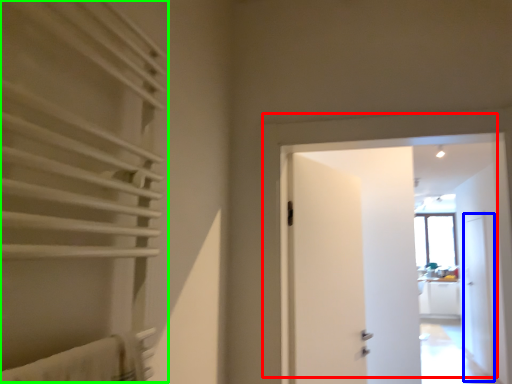
Question: Based on their relative distances, which object is nearer to door (highlighted by a red box)? Choose from screen door (highlighted by a blue box) and curtain (highlighted by a green box).

Choices:
 (A) screen door
 (B) curtain

Answer: (B)